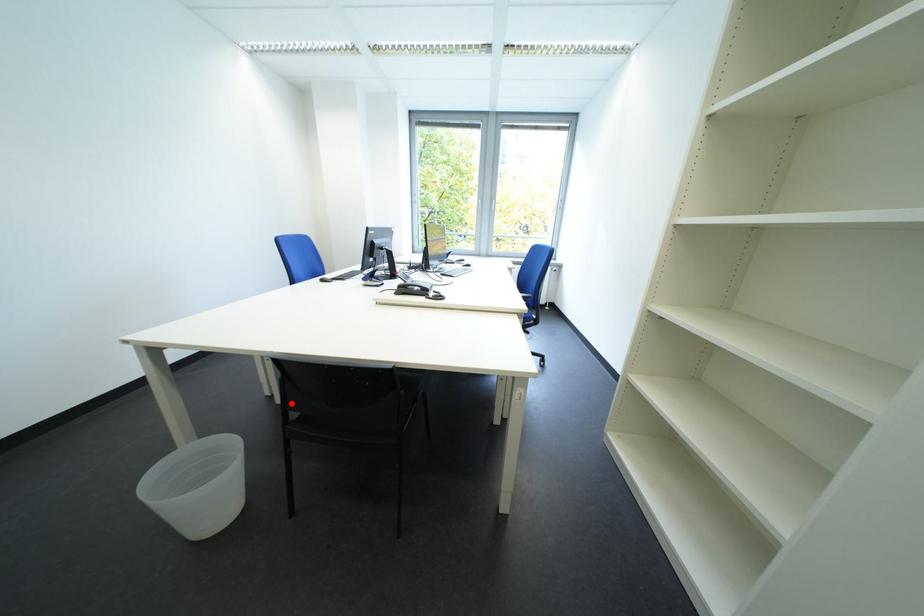
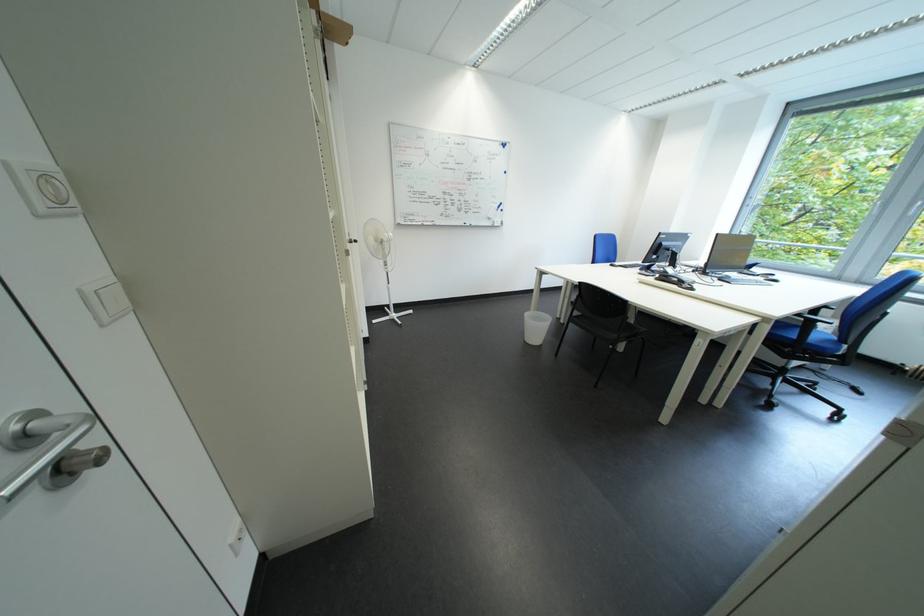
Question: I am providing you with two images of the same scene from different viewpoints. A red point is shown in image1. For the corresponding object point in image2, is it positioned nearer or farther from the camera?

Choices:
 (A) Nearer
 (B) Farther

Answer: (A)